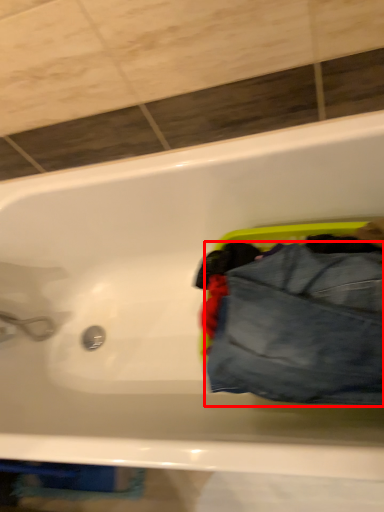
Question: From the image's perspective, where is trousers (annotated by the red box) located in relation to bathtub in the image?

Choices:
 (A) below
 (B) above

Answer: (B)